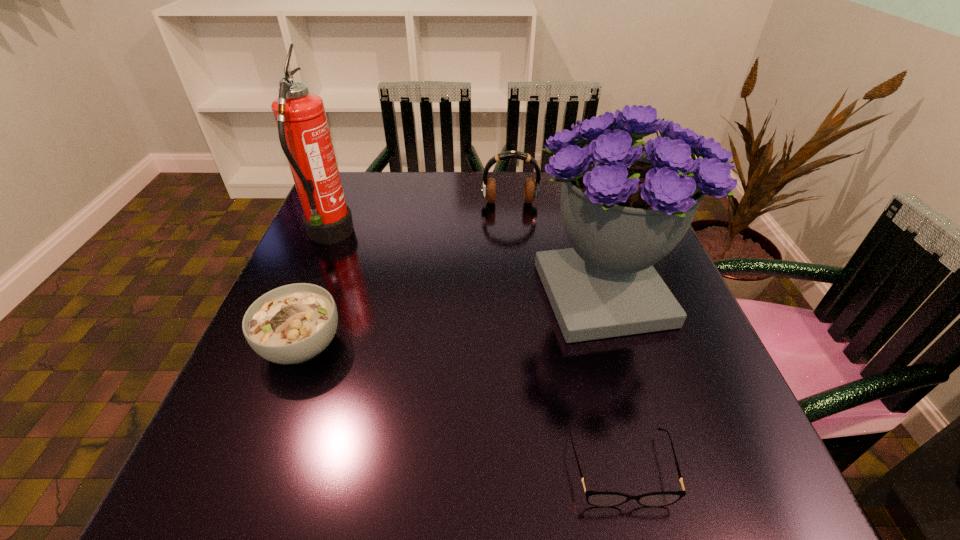
This screenshot has height=540, width=960. In order to click on vacant space located 0.170m on the right of the second shortest object in this screenshot , I will do `click(434, 345)`.

Find the location of `fire extinguisher present at the far edge`. fire extinguisher present at the far edge is located at coordinates (304, 134).

The image size is (960, 540). In order to click on headset that is at the far edge in this screenshot , I will do coord(531,188).

What are the coordinates of `object that is at the near edge` in the screenshot? It's located at (600, 498).

What are the coordinates of `fire extinguisher situated at the left edge` in the screenshot? It's located at click(304, 134).

What are the coordinates of `soup bowl that is at the left edge` in the screenshot? It's located at (293, 323).

This screenshot has height=540, width=960. Identify the location of bouquet at the right edge. coord(625,205).

The width and height of the screenshot is (960, 540). What are the coordinates of `spectacles at the right edge` in the screenshot? It's located at (600, 498).

Where is `object situated at the far left corner`? object situated at the far left corner is located at coordinates (304, 134).

This screenshot has width=960, height=540. In order to click on object at the near right corner in this screenshot , I will do `click(600, 498)`.